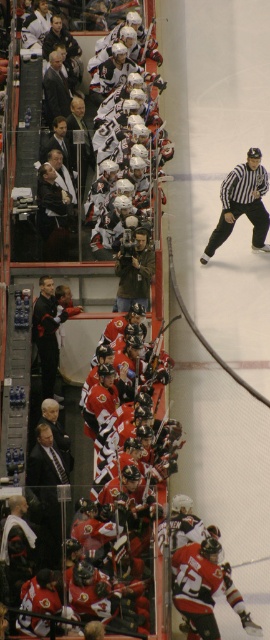
In the scene shown: You are a photographer positioned at the center of the bench area. You need to capture a photo of the orange jersey at center. Based on its coordinates, is it within your field of view if your camera has a standard 50mm lens and you are focused on the center of the bench?

The orange jersey at center is located at point coordinates, so it is within your field of view since it is at the center of the bench area.

In the hockey bench scene, you notice two jerseys hanging at the center of the bench area. The orange jersey at center and the black jersey at center. Which one has a shorter length?

The orange jersey at center is shorter than the black jersey at center.

You are a photographer positioned behind the bench area. You want to take a photo of the orange jersey at center and the black jersey at center so that both are clearly visible. Based on their positions, which jersey should you focus on first to ensure both are in frame?

The orange jersey at center is in front of the black jersey at center, so you should focus on the orange jersey at center first to ensure it doesn not block the black jersey at center in the photo.